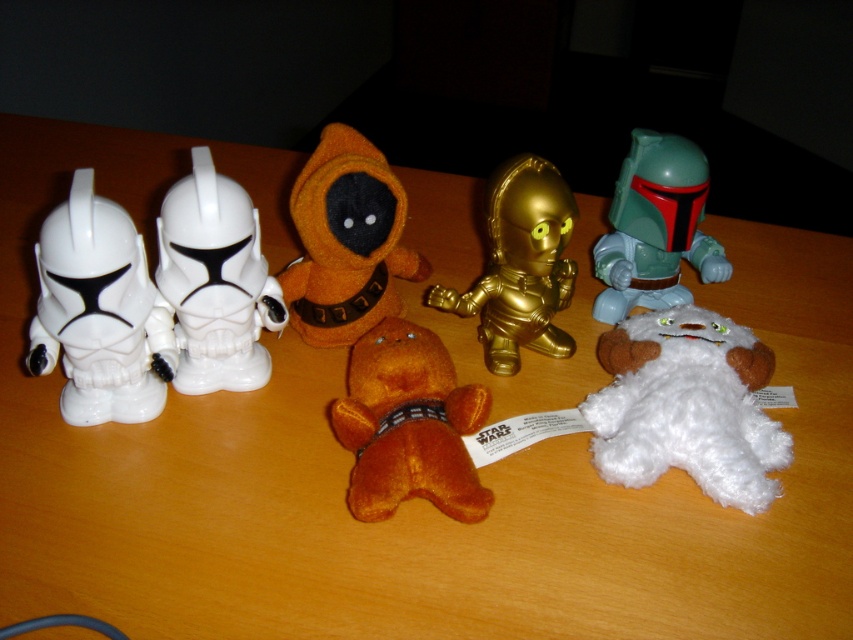
Question: Which point is farther to the camera?

Choices:
 (A) (715, 378)
 (B) (654, 202)

Answer: (B)

Question: In this image, where is fuzzy orange bear at center located relative to orange plush at center?

Choices:
 (A) right
 (B) left

Answer: (A)

Question: Which is nearer to the fuzzy orange bear at center?

Choices:
 (A) teal plastic boba fett action figure at right
 (B) white fluffy stuffed toy at lower right
 (C) orange plush at center
 (D) white glossy helmet at left

Answer: (C)

Question: Is gold metallic robot at center bigger than teal plastic boba fett action figure at right?

Choices:
 (A) yes
 (B) no

Answer: (A)

Question: Which object is positioned farthest from the white glossy plastic toy at left?

Choices:
 (A) teal plastic boba fett action figure at right
 (B) gold metallic robot at center
 (C) fuzzy orange bear at center

Answer: (A)

Question: Is fuzzy orange bear at center above orange plush at center?

Choices:
 (A) no
 (B) yes

Answer: (A)